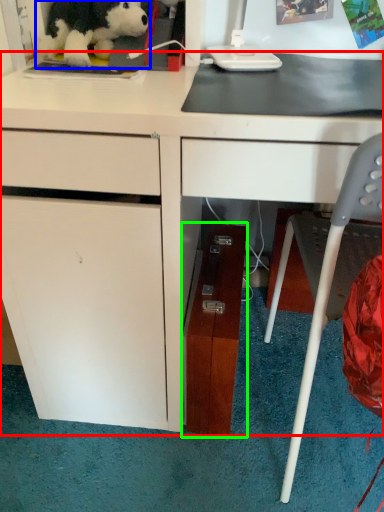
Question: Based on their relative distances, which object is farther from desk (highlighted by a red box)? Choose from toy (highlighted by a blue box) and file cabinet (highlighted by a green box).

Choices:
 (A) toy
 (B) file cabinet

Answer: (A)